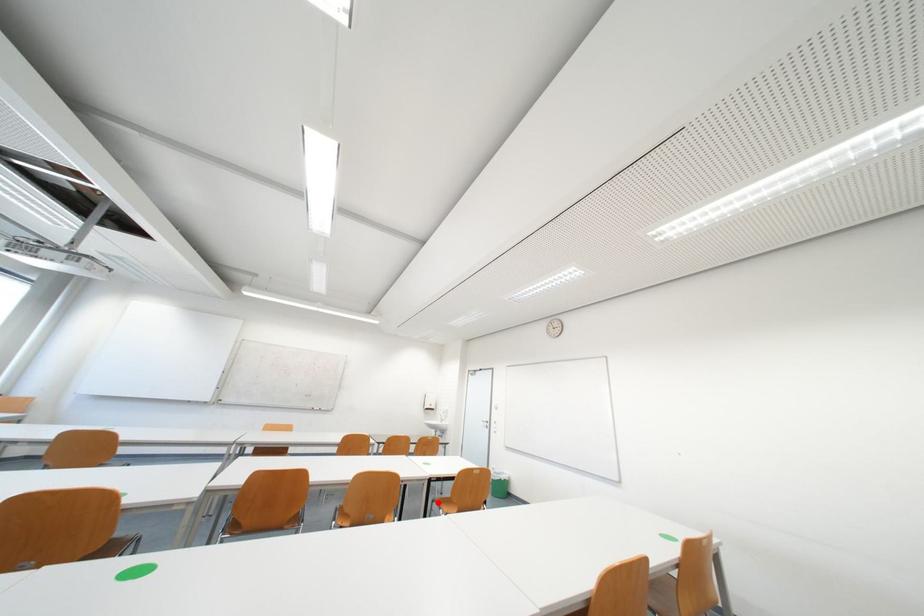
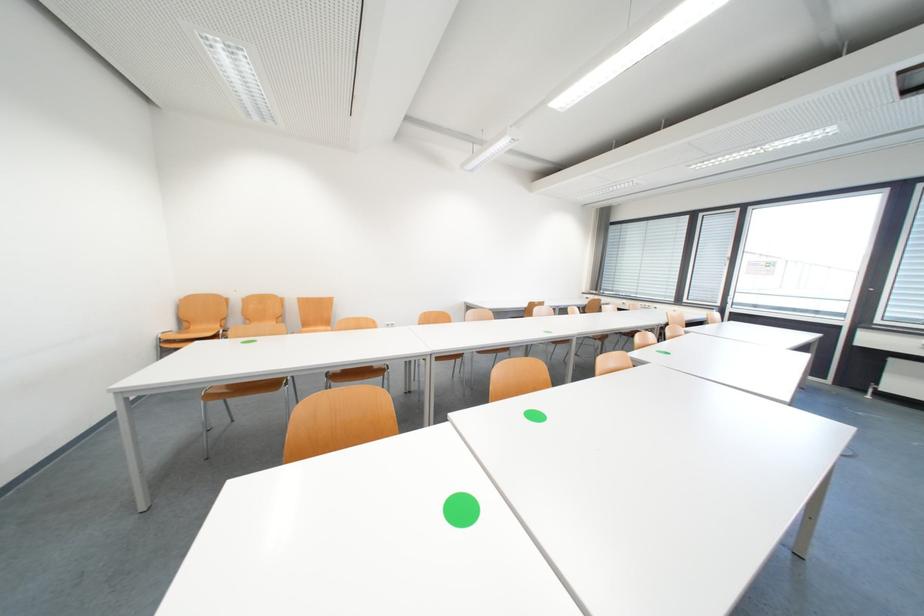
Question: I am providing you with two images of the same scene from different viewpoints. A red point is marked on the first image. Is the red point's position out of view in image 2?

Choices:
 (A) Yes
 (B) No

Answer: (A)